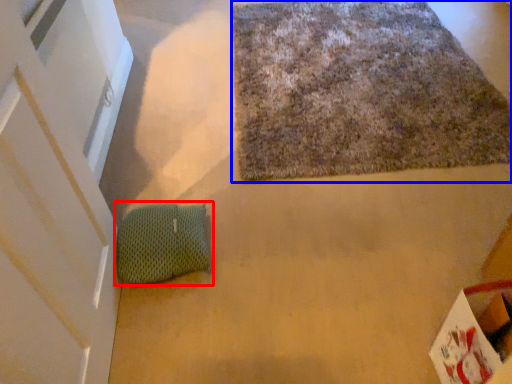
Question: Which point is further to the camera, bean bag chair (highlighted by a red box) or mat (highlighted by a blue box)?

Choices:
 (A) bean bag chair
 (B) mat

Answer: (B)